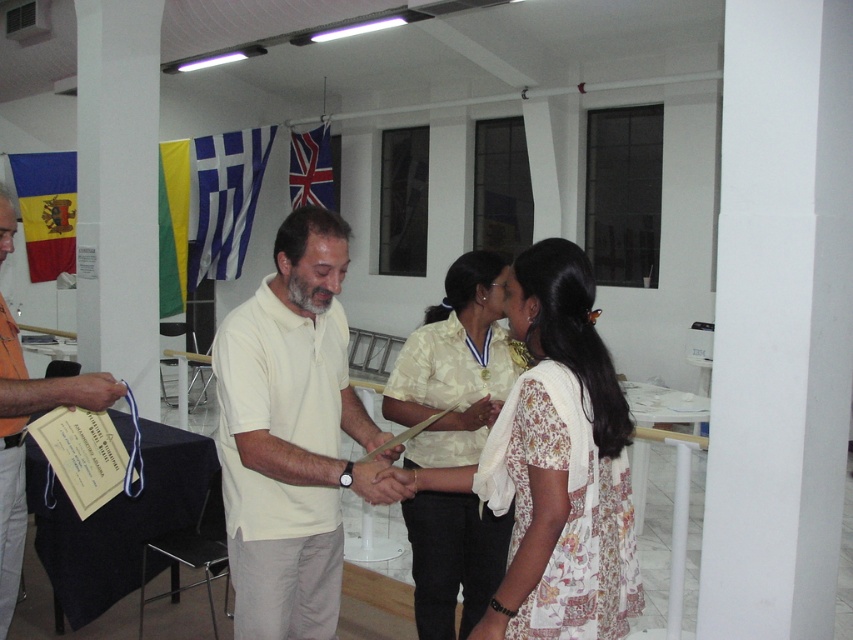
You are a photographer at the event and need to position yourself so that both the white floral dress at center and the blue and yellow fabric flag at left are visible in your shot. Given that the flag is wider than the dress, which object should you ensure is closer to the edges of the frame to avoid cropping?

Since the blue and yellow fabric flag at left is wider than the white floral dress at center, you should position the blue and yellow fabric flag at left closer to the edges of the frame to prevent it from being cropped out while ensuring the white floral dress at center remains centered.

You are standing in the room and want to locate the orange fabric shirt at left. Based on the coordinates provided, where should you look to find it?

The orange fabric shirt at left is located at the coordinates point (22, 440).